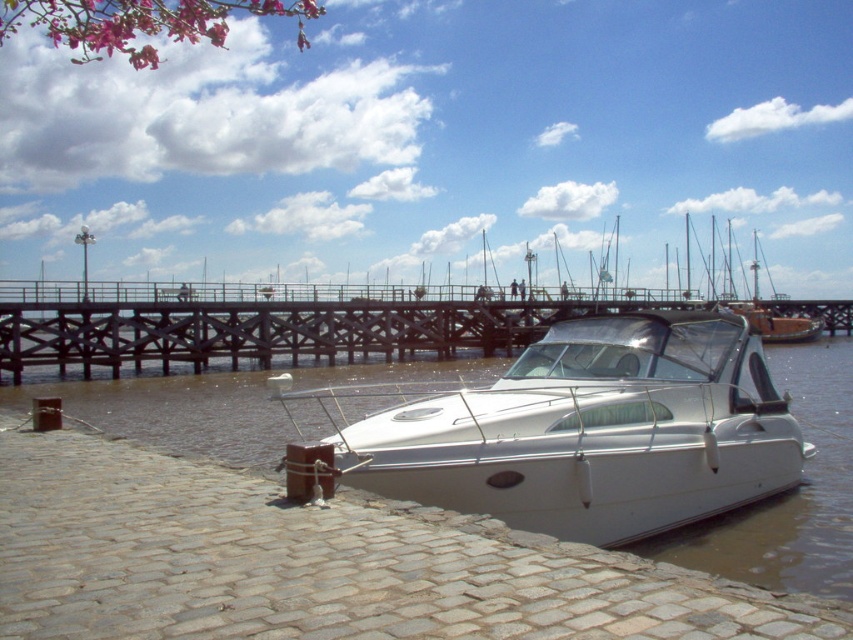
Question: Is white glossy boat at center closer to the viewer compared to white glossy water at center?

Choices:
 (A) no
 (B) yes

Answer: (B)

Question: Which point is farther to the camera?

Choices:
 (A) white glossy dock at center
 (B) white glossy water at center
 (C) white glossy boat at center

Answer: (A)

Question: Which point is closer to the camera?

Choices:
 (A) white glossy water at center
 (B) white glossy boat at center
 (C) white glossy dock at center

Answer: (B)

Question: Can you confirm if white glossy water at center is wider than white glossy dock at center?

Choices:
 (A) no
 (B) yes

Answer: (A)

Question: Can you confirm if white glossy boat at center is bigger than white glossy water at center?

Choices:
 (A) yes
 (B) no

Answer: (B)

Question: Which of the following is the farthest from the observer?

Choices:
 (A) (816, 364)
 (B) (33, 364)
 (C) (668, 310)

Answer: (A)